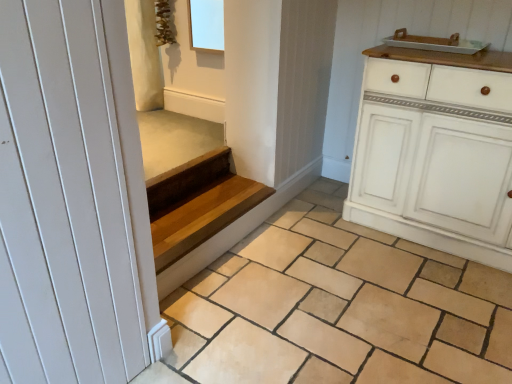
Question: Is white ceramic tray at upper right bigger or smaller than white smooth door at left?

Choices:
 (A) big
 (B) small

Answer: (B)

Question: From a real-world perspective, is white ceramic tray at upper right positioned above or below white smooth door at left?

Choices:
 (A) below
 (B) above

Answer: (B)

Question: Based on their relative distances, which object is nearer to the white ceramic tray at upper right?

Choices:
 (A) natural stone tile at center
 (B) white smooth door at left
 (C) white painted wood cabinet at right
 (D) wooden stairs at center

Answer: (C)

Question: Estimate the real-world distances between objects in this image. Which object is closer to the natural stone tile at center?

Choices:
 (A) white smooth door at left
 (B) white ceramic tray at upper right
 (C) white painted wood cabinet at right
 (D) wooden stairs at center

Answer: (C)